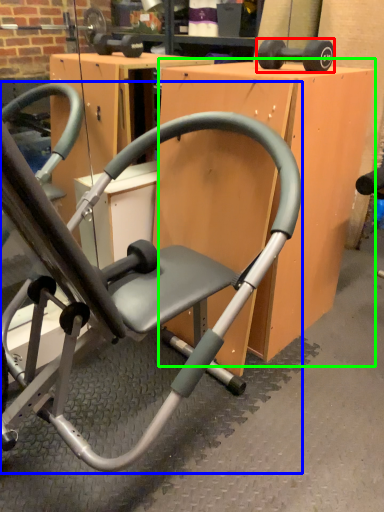
Question: Based on their relative distances, which object is farther from dumbbell (highlighted by a red box)? Choose from chair (highlighted by a blue box) and table (highlighted by a green box).

Choices:
 (A) chair
 (B) table

Answer: (A)